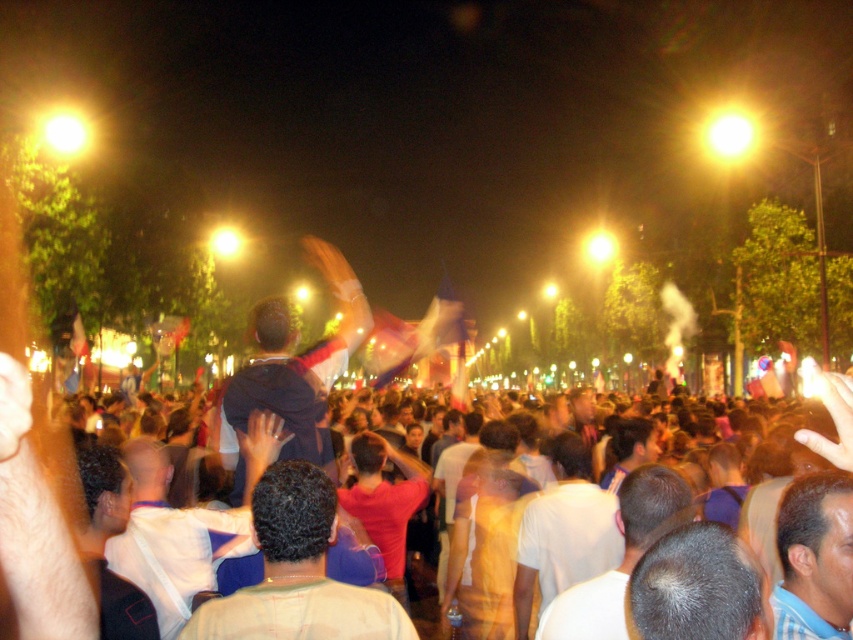
Can you confirm if white fabric shirt at center is positioned to the left of light blue striped shirt at center?

Indeed, white fabric shirt at center is positioned on the left side of light blue striped shirt at center.

The height and width of the screenshot is (640, 853). Describe the element at coordinates (173, 540) in the screenshot. I see `white fabric shirt at center` at that location.

Which is in front, point (170, 573) or point (814, 540)?

Point (814, 540) is more forward.

Where is `white fabric shirt at center`? The height and width of the screenshot is (640, 853). white fabric shirt at center is located at coordinates (173, 540).

Who is shorter, white fabric shirt at center or yellow t-shirt at center?

Standing shorter between the two is white fabric shirt at center.

Measure the distance between point (x=169, y=573) and camera.

They are 10.42 meters apart.

Identify the location of white fabric shirt at center. This screenshot has width=853, height=640. (173, 540).

Can you confirm if light brown hair at center is positioned below red matte shirt at center?

No.

Does point (668, 508) lie in front of point (386, 504)?

Yes, it is in front of point (386, 504).

Identify the location of light brown hair at center. (622, 557).